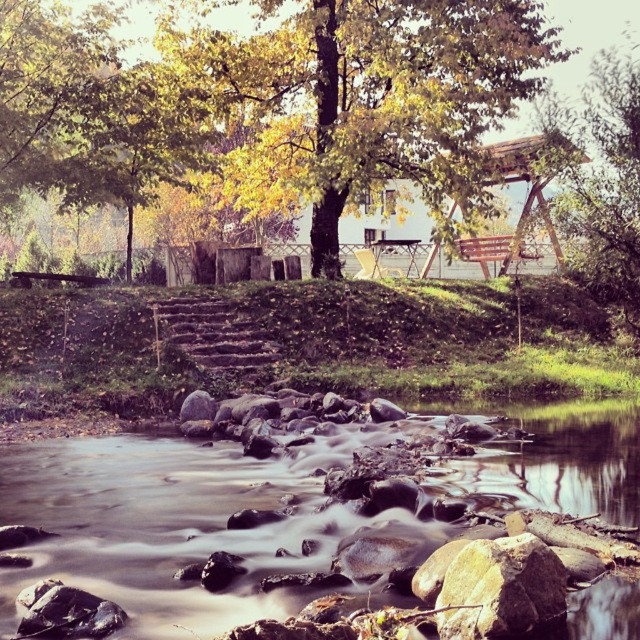
Can you confirm if smooth rock river at lower center is positioned above green leafy tree at upper center?

Actually, smooth rock river at lower center is below green leafy tree at upper center.

Is smooth rock river at lower center bigger than green leafy tree at upper center?

Incorrect, smooth rock river at lower center is not larger than green leafy tree at upper center.

Is point (173, 476) more distant than point (625, 172)?

No, (173, 476) is closer to viewer.

I want to click on smooth rock river at lower center, so click(168, 524).

Is yellow-green leaves at upper center closer to the viewer compared to green leafy tree at upper center?

No, it is behind green leafy tree at upper center.

Can you confirm if yellow-green leaves at upper center is wider than green leafy tree at upper center?

Indeed, yellow-green leaves at upper center has a greater width compared to green leafy tree at upper center.

What do you see at coordinates (369, 100) in the screenshot?
I see `yellow-green leaves at upper center` at bounding box center [369, 100].

At what (x,y) coordinates should I click in order to perform the action: click on yellow-green leaves at upper center. Please return your answer as a coordinate pair (x, y). The height and width of the screenshot is (640, 640). Looking at the image, I should click on (369, 100).

Is green leafy tree at upper center below brown wooden stairs at center?

No.

Which of these two, green leafy tree at upper center or brown wooden stairs at center, stands taller?

With more height is green leafy tree at upper center.

Locate an element on the screen. The width and height of the screenshot is (640, 640). green leafy tree at upper center is located at coordinates [x=602, y=182].